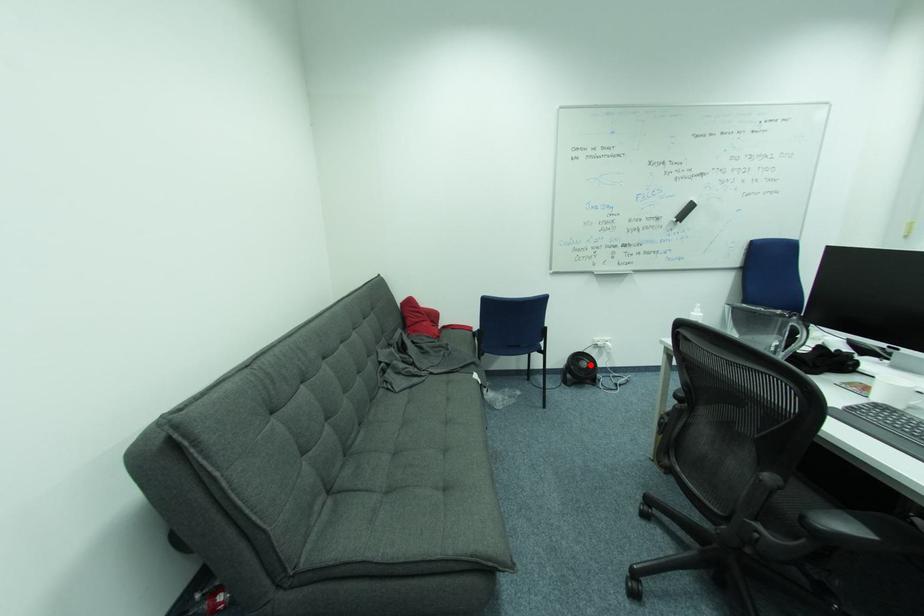
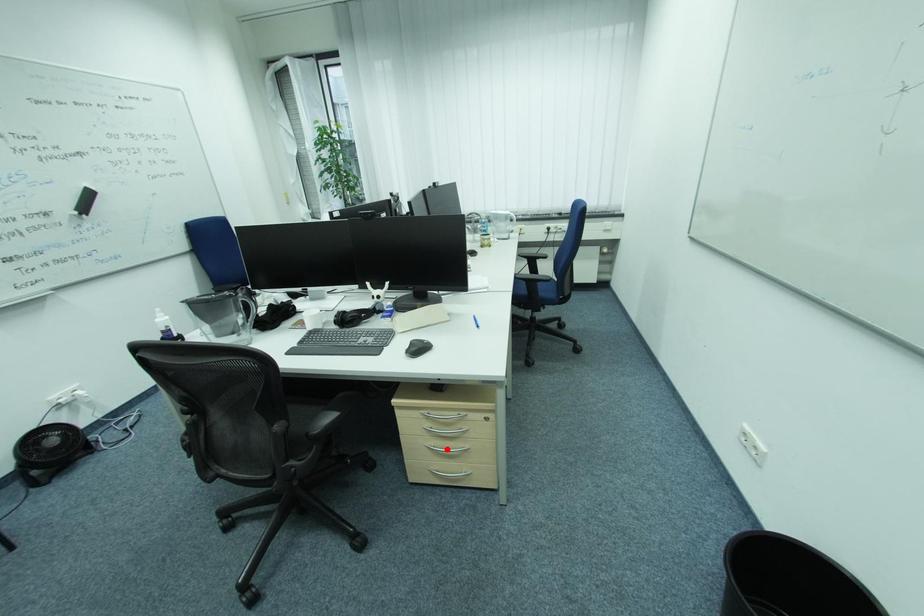
I am providing you with two images of the same scene from different viewpoints. A red point is marked on the first image and another point is marked on the second image. Does the point marked in image1 correspond to the same location as the one in image2?

No